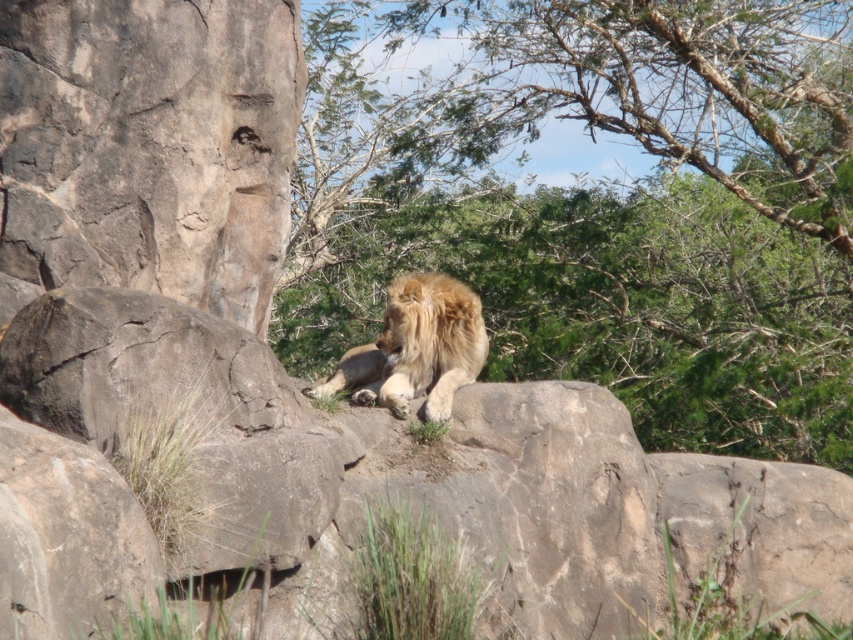
This screenshot has width=853, height=640. What do you see at coordinates (601, 205) in the screenshot?
I see `green leafy tree at upper center` at bounding box center [601, 205].

What do you see at coordinates (601, 205) in the screenshot?
I see `green leafy tree at upper center` at bounding box center [601, 205].

This screenshot has height=640, width=853. What are the coordinates of `green leafy tree at upper center` in the screenshot? It's located at (601, 205).